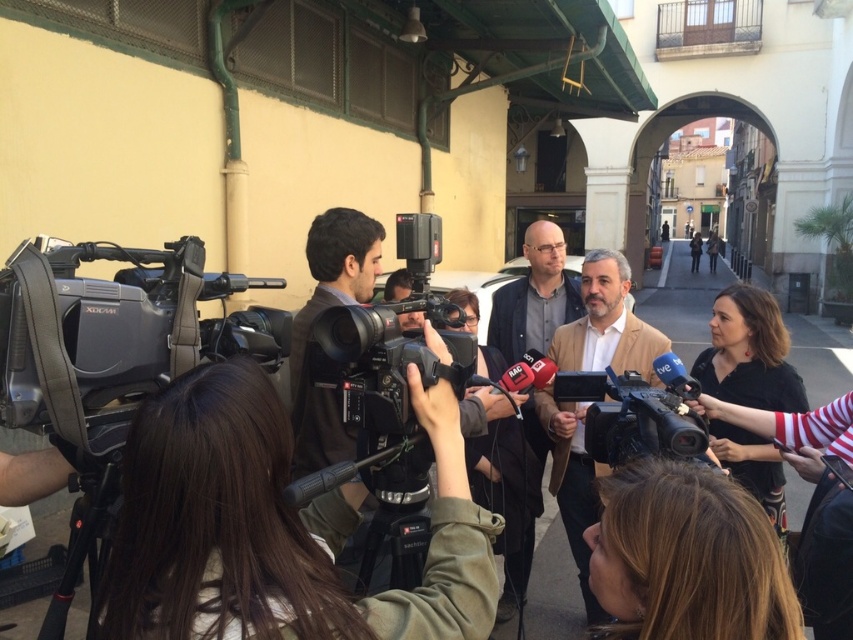
Question: Is black plastic camera at center thinner than matte brown jacket at center?

Choices:
 (A) no
 (B) yes

Answer: (B)

Question: Among these points, which one is nearest to the camera?

Choices:
 (A) (555, 352)
 (B) (454, 342)
 (C) (540, 429)
 (D) (657, 452)

Answer: (D)

Question: In this image, where is light brown suit at center located relative to black plastic camera at center?

Choices:
 (A) below
 (B) above

Answer: (A)

Question: Among these points, which one is farthest from the camera?

Choices:
 (A) (347, 420)
 (B) (587, 433)
 (C) (579, 586)

Answer: (C)

Question: Which is farther from the light brown suit at center?

Choices:
 (A) black matte camera at center
 (B) black plastic camera at center

Answer: (A)

Question: Can you confirm if black matte camera at center is thinner than black plastic camera at center?

Choices:
 (A) yes
 (B) no

Answer: (A)